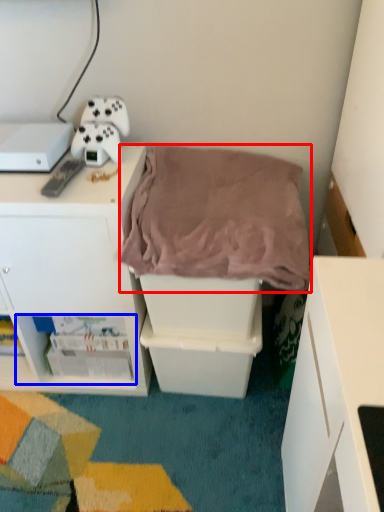
Question: Which of the following is the farthest to the observer, blanket (highlighted by a red box) or shelf (highlighted by a blue box)?

Choices:
 (A) blanket
 (B) shelf

Answer: (B)